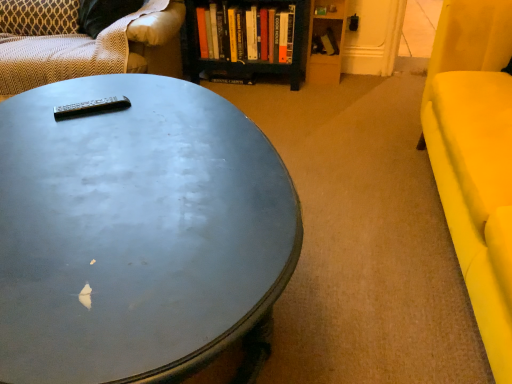
You are a GUI agent. You are given a task and a screenshot of the screen. Output one action in this format:
    pyautogui.click(x=<x>, y=<y>)
    Task: Click on the free spot in front of black plastic remote at center
    
    Given the screenshot: What is the action you would take?
    pyautogui.click(x=76, y=136)